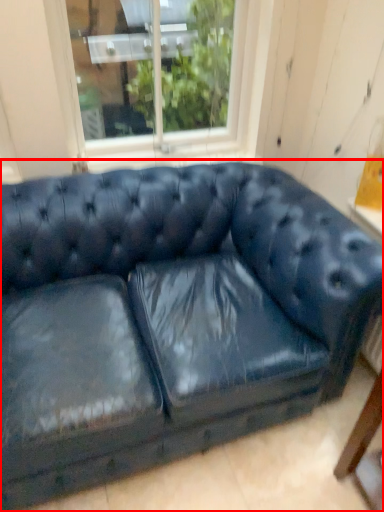
Question: From the image's perspective, where is studio couch (annotated by the red box) located relative to window?

Choices:
 (A) below
 (B) above

Answer: (A)